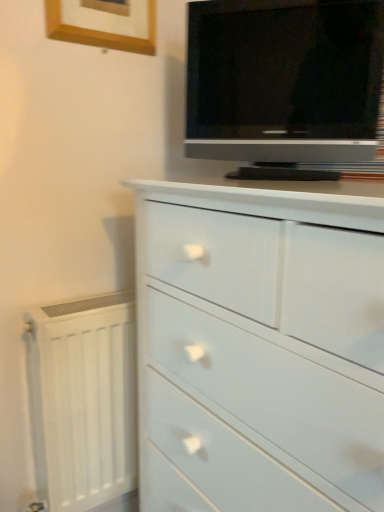
Question: From the image's perspective, is wooden picture frame at upper left beneath matte black tv at upper right?

Choices:
 (A) yes
 (B) no

Answer: (B)

Question: Would you consider wooden picture frame at upper left to be distant from matte black tv at upper right?

Choices:
 (A) no
 (B) yes

Answer: (A)

Question: Is wooden picture frame at upper left located outside matte black tv at upper right?

Choices:
 (A) yes
 (B) no

Answer: (A)

Question: Does wooden picture frame at upper left have a greater height compared to matte black tv at upper right?

Choices:
 (A) yes
 (B) no

Answer: (B)

Question: Are wooden picture frame at upper left and matte black tv at upper right beside each other?

Choices:
 (A) no
 (B) yes

Answer: (A)

Question: Considering the relative positions of matte black tv at upper right and white glossy chest of drawers at center in the image provided, is matte black tv at upper right to the left or to the right of white glossy chest of drawers at center?

Choices:
 (A) left
 (B) right

Answer: (A)

Question: From a real-world perspective, relative to white glossy chest of drawers at center, is matte black tv at upper right vertically above or below?

Choices:
 (A) below
 (B) above

Answer: (B)

Question: Is point (263, 130) positioned closer to the camera than point (355, 480)?

Choices:
 (A) closer
 (B) farther

Answer: (B)

Question: Is matte black tv at upper right situated inside white glossy chest of drawers at center or outside?

Choices:
 (A) outside
 (B) inside

Answer: (A)

Question: Considering the positions of wooden picture frame at upper left and white glossy chest of drawers at center in the image, is wooden picture frame at upper left taller or shorter than white glossy chest of drawers at center?

Choices:
 (A) short
 (B) tall

Answer: (A)

Question: Choose the correct answer: Is wooden picture frame at upper left inside white glossy chest of drawers at center or outside it?

Choices:
 (A) inside
 (B) outside

Answer: (B)

Question: In the image, is wooden picture frame at upper left on the left side or the right side of white glossy chest of drawers at center?

Choices:
 (A) left
 (B) right

Answer: (A)

Question: Relative to white glossy chest of drawers at center, is wooden picture frame at upper left in front or behind?

Choices:
 (A) behind
 (B) front

Answer: (A)

Question: Is matte black tv at upper right taller or shorter than white painted radiator at lower left?

Choices:
 (A) tall
 (B) short

Answer: (B)

Question: Is matte black tv at upper right situated inside white painted radiator at lower left or outside?

Choices:
 (A) inside
 (B) outside

Answer: (B)